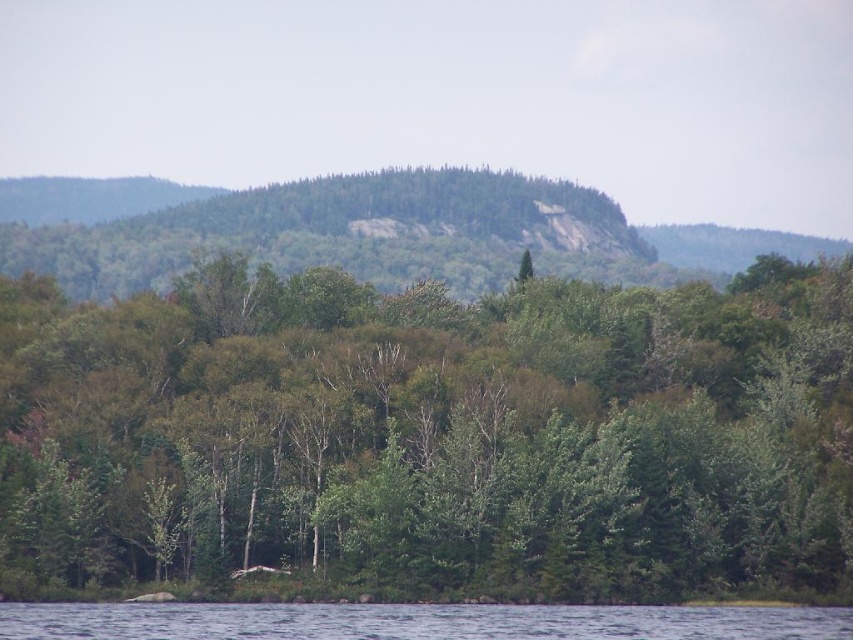
You are planning to set up a tent in this forest area. You need to choose between the area near the green leafy trees at center or the area near the clear water at lower center. Which area has more space for your tent?

The green leafy trees at center has a larger width than the clear water at lower center, so the area near the green leafy trees at center has more space for your tent.